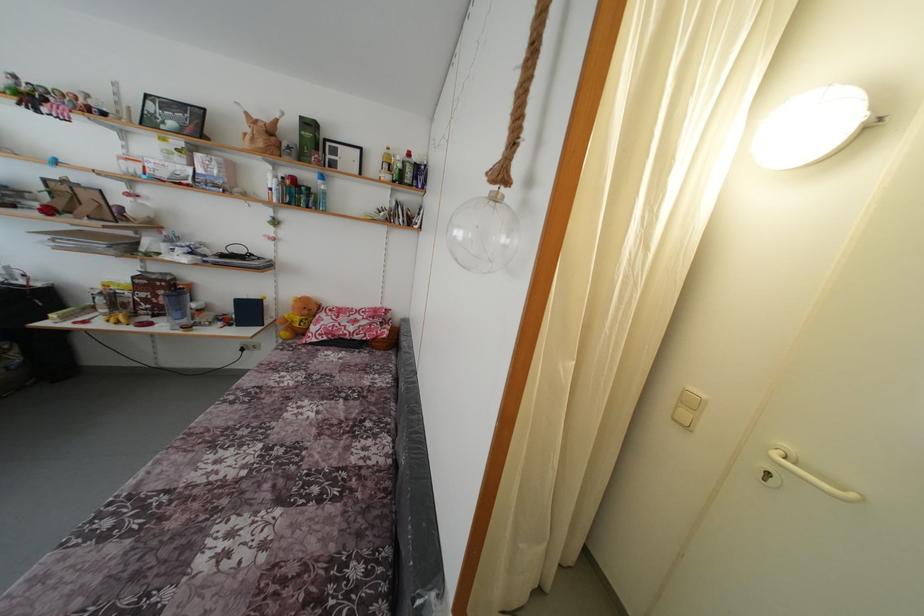
What do you see at coordinates (687, 408) in the screenshot?
I see `a light switch button` at bounding box center [687, 408].